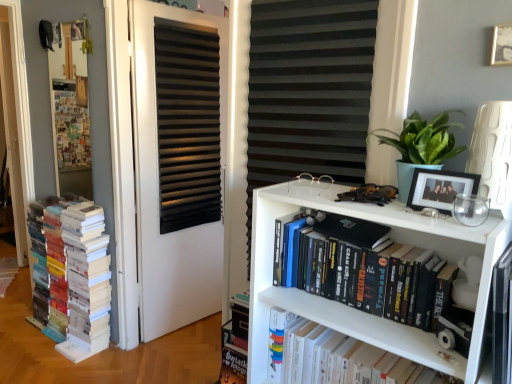
Question: Does black matte picture frame at upper right, the second picture frame from the right, appear on the right side of wooden bulletin board at left?

Choices:
 (A) no
 (B) yes

Answer: (B)

Question: From a real-world perspective, is black matte picture frame at upper right, which is the 1th picture frame from bottom to top, beneath wooden bulletin board at left?

Choices:
 (A) no
 (B) yes

Answer: (B)

Question: Does black matte picture frame at upper right, which is the 1th picture frame from bottom to top, have a greater height compared to wooden bulletin board at left?

Choices:
 (A) yes
 (B) no

Answer: (B)

Question: Is black matte picture frame at upper right, the 1th picture frame in the left-to-right sequence, closer to the viewer compared to wooden bulletin board at left?

Choices:
 (A) yes
 (B) no

Answer: (A)

Question: Is wooden bulletin board at left inside black matte picture frame at upper right, the 1th picture frame in the left-to-right sequence?

Choices:
 (A) yes
 (B) no

Answer: (B)

Question: From the image's perspective, is black matte picture frame at upper right, the second picture frame from the right, over wooden bulletin board at left?

Choices:
 (A) yes
 (B) no

Answer: (B)

Question: Can you confirm if multicolored paper books at left, the 1th book in the back-to-front sequence, is positioned to the right of gold metallic picture frame at upper right, positioned as the 1th picture frame in top-to-bottom order?

Choices:
 (A) yes
 (B) no

Answer: (B)

Question: Considering the relative sizes of multicolored paper books at left, the 1th book in the back-to-front sequence, and gold metallic picture frame at upper right, the 2th picture frame ordered from the bottom, in the image provided, is multicolored paper books at left, the 1th book in the back-to-front sequence, shorter than gold metallic picture frame at upper right, the 2th picture frame ordered from the bottom,?

Choices:
 (A) yes
 (B) no

Answer: (B)

Question: Is multicolored paper books at left, which is the first book in left-to-right order, positioned behind gold metallic picture frame at upper right, the 2th picture frame ordered from the bottom?

Choices:
 (A) yes
 (B) no

Answer: (A)

Question: Is multicolored paper books at left, positioned as the third book in front-to-back order, with gold metallic picture frame at upper right, the 2th picture frame ordered from the bottom?

Choices:
 (A) yes
 (B) no

Answer: (B)

Question: Is multicolored paper books at left, arranged as the 3th book when viewed from the right, thinner than gold metallic picture frame at upper right, the 1th picture frame positioned from the right?

Choices:
 (A) yes
 (B) no

Answer: (B)

Question: Could you tell me if multicolored paper books at left, the 1th book in the back-to-front sequence, is turned towards gold metallic picture frame at upper right, the 2th picture frame when ordered from left to right?

Choices:
 (A) yes
 (B) no

Answer: (B)

Question: Would you say multicolored paper books at left, positioned as the third book in front-to-back order, is outside white matte bookshelf at center, the third book positioned from the back?

Choices:
 (A) no
 (B) yes

Answer: (B)